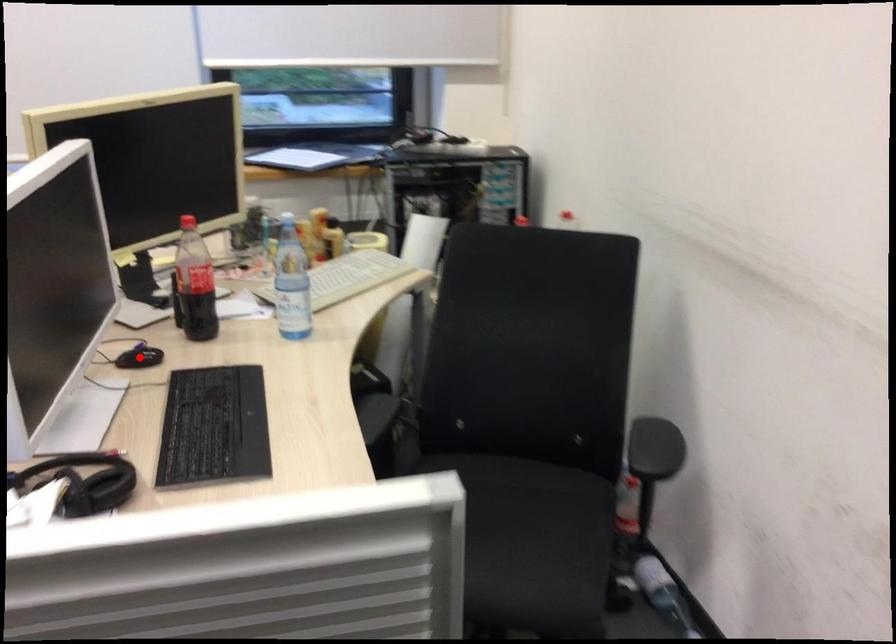
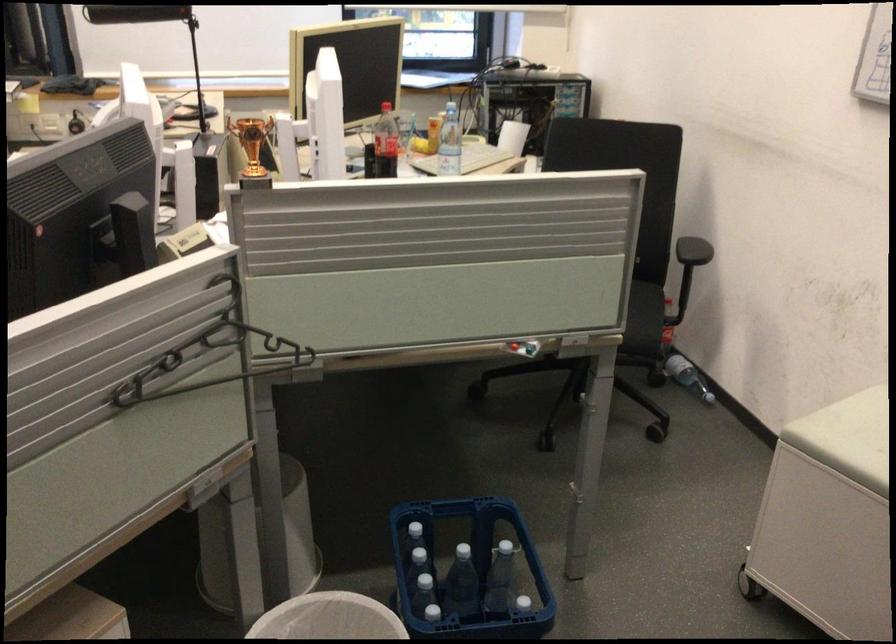
Question: I am providing you with two images of the same scene from different viewpoints. A red point is marked on the first image. Can you still see the location of the red point in image 2?

Choices:
 (A) Yes
 (B) No

Answer: (B)